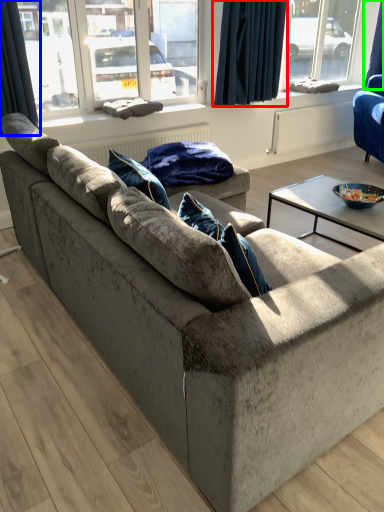
Question: Which is nearer to the curtain (highlighted by a red box)? curtain (highlighted by a blue box) or curtain (highlighted by a green box).

Choices:
 (A) curtain
 (B) curtain

Answer: (A)